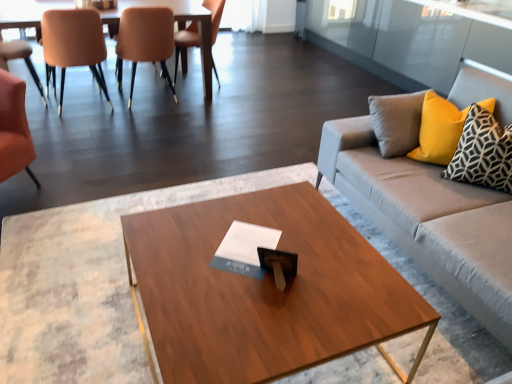
Find the location of a particular element. This screenshot has width=512, height=384. blank space to the left of wooden coffee table at center is located at coordinates (76, 290).